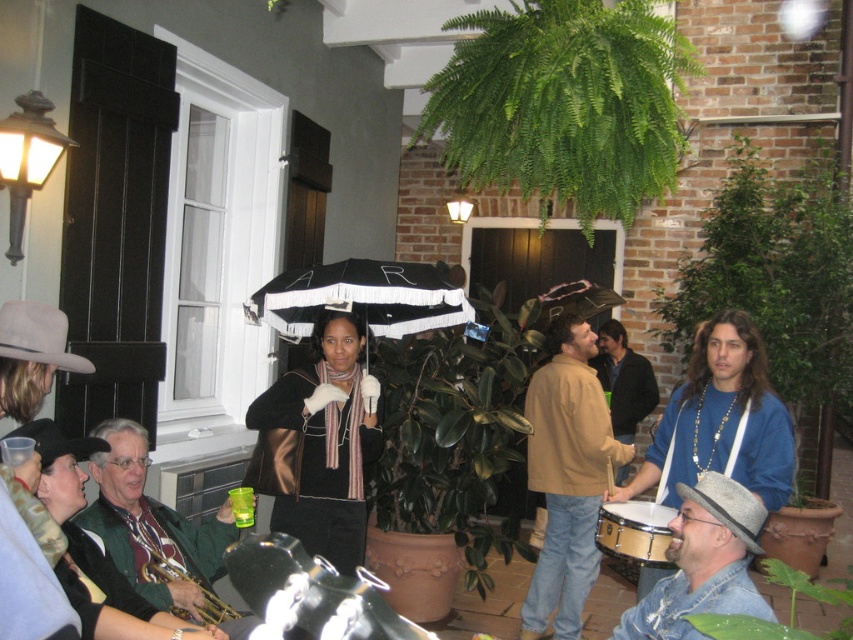
You are at a party and want to borrow the gold brass trumpet at lower left. However, there is a green velvet jacket at lower left in the way. Can you easily access the trumpet without moving the jacket?

Answer: The green velvet jacket at lower left is in front of the gold brass trumpet at lower left, so you cannot easily access the trumpet without moving the jacket.

You are organizing a coat rack and need to hang the green velvet jacket at lower left and the gold brass trumpet at lower left. Which item requires more horizontal space on the rack?

The green velvet jacket at lower left might be wider than gold brass trumpet at lower left, so it requires more horizontal space on the rack.

From the picture: You are organizing a coat rack and need to place the green velvet jacket at lower left and the denim hat at lower right. Which item requires more horizontal space due to its width?

The green velvet jacket at lower left requires more horizontal space because its width surpasses that of the denim hat at lower right.